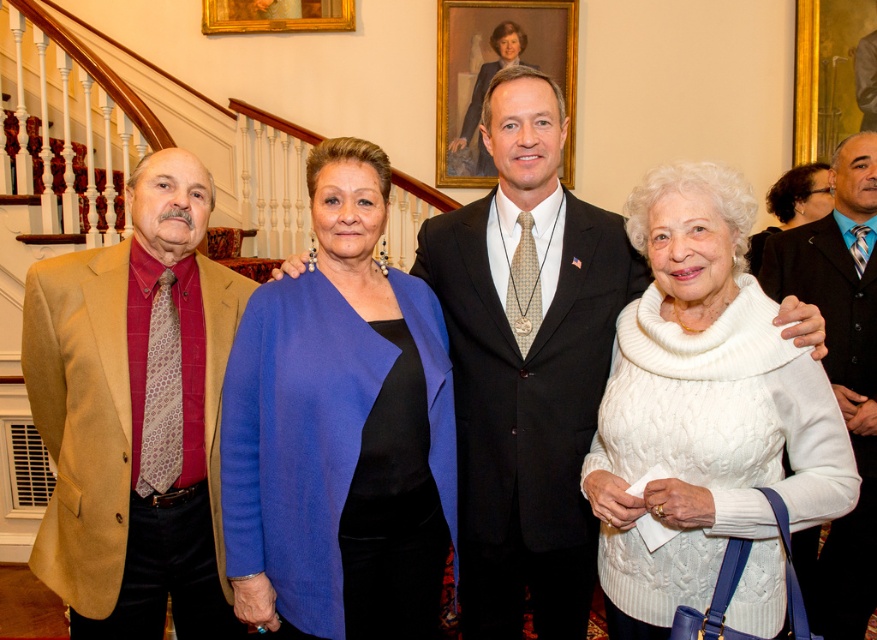
Is dark blue suit at center taller than goldwooden frame at upper center?

Indeed, dark blue suit at center has a greater height compared to goldwooden frame at upper center.

Does dark blue suit at center appear under goldwooden frame at upper center?

Yes, dark blue suit at center is below goldwooden frame at upper center.

Is point (843, 250) farther from viewer compared to point (291, 12)?

No, (843, 250) is closer to viewer.

The height and width of the screenshot is (640, 877). I want to click on dark blue suit at center, so click(840, 376).

Can you confirm if blue woolen jacket at center is bigger than wooden portrait frame at upper center?

Actually, blue woolen jacket at center might be smaller than wooden portrait frame at upper center.

Measure the distance between point (305, 504) and camera.

5.72 feet

This screenshot has width=877, height=640. I want to click on blue woolen jacket at center, so click(x=339, y=429).

Who is shorter, goldwooden frame at upper center or black shiny hair at upper right?

goldwooden frame at upper center

Between goldwooden frame at upper center and black shiny hair at upper right, which one has more height?

Standing taller between the two is black shiny hair at upper right.

Image resolution: width=877 pixels, height=640 pixels. I want to click on goldwooden frame at upper center, so click(276, 16).